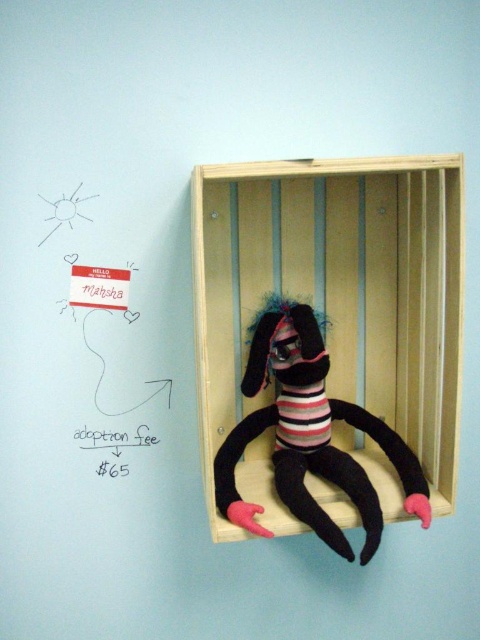
Question: Is wooden crate at center bigger than striped fabric plush toy at center?

Choices:
 (A) yes
 (B) no

Answer: (A)

Question: Which of these objects is positioned closest to the black paper adoption fee at center?

Choices:
 (A) striped fabric plush toy at center
 (B) wooden crate at center

Answer: (A)

Question: Does wooden crate at center appear under black paper adoption fee at center?

Choices:
 (A) no
 (B) yes

Answer: (A)

Question: Does wooden crate at center appear over black paper adoption fee at center?

Choices:
 (A) no
 (B) yes

Answer: (B)

Question: Which point is farther from the camera taking this photo?

Choices:
 (A) (396, 280)
 (B) (235, 452)

Answer: (A)

Question: Which object is the closest to the wooden crate at center?

Choices:
 (A) striped fabric plush toy at center
 (B) black paper adoption fee at center

Answer: (A)